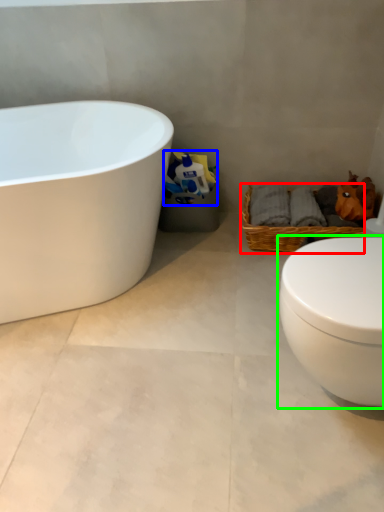
Question: Estimate the real-world distances between objects in this image. Which object is closer to picnic basket (highlighted by a red box), toilet paper (highlighted by a blue box) or toilet (highlighted by a green box)?

Choices:
 (A) toilet paper
 (B) toilet

Answer: (A)